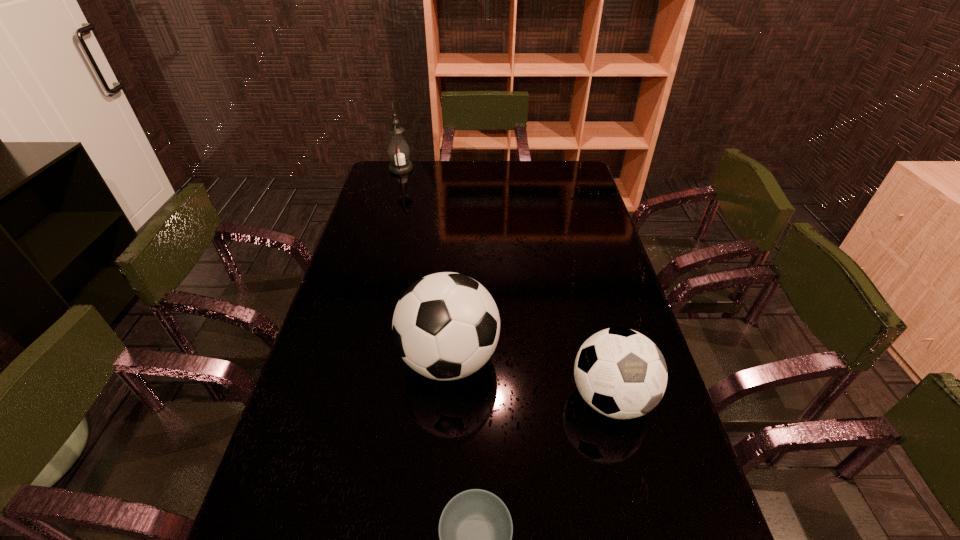
Where is `vacant space that's between the left soccer ball and the rightmost object`? The width and height of the screenshot is (960, 540). vacant space that's between the left soccer ball and the rightmost object is located at coordinates (530, 379).

Locate an element on the screen. This screenshot has width=960, height=540. empty space between the right soccer ball and the left soccer ball is located at coordinates (530, 379).

At what (x,y) coordinates should I click in order to perform the action: click on unoccupied position between the second shortest object and the oil lamp. Please return your answer as a coordinate pair (x, y). The width and height of the screenshot is (960, 540). Looking at the image, I should click on (506, 283).

Find the location of a particular element. This screenshot has height=540, width=960. object that stands as the second closest to the taller soccer ball is located at coordinates (475, 529).

At what (x,y) coordinates should I click in order to perform the action: click on the second closest object to the second shortest object. Please return your answer as a coordinate pair (x, y). This screenshot has height=540, width=960. Looking at the image, I should click on (475, 529).

Image resolution: width=960 pixels, height=540 pixels. I want to click on vacant space that satisfies the following two spatial constraints: 1. on the front side of the taller soccer ball; 2. on the left side of the leftmost object, so click(349, 359).